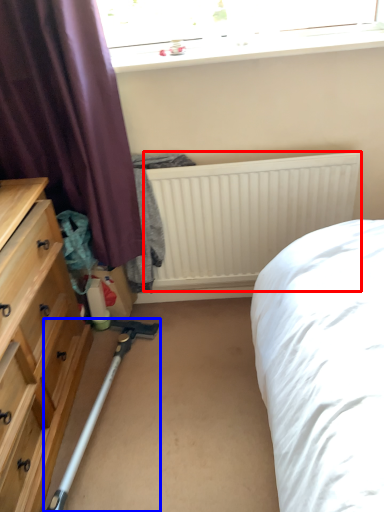
Question: Among these objects, which one is nearest to the camera, radiator (highlighted by a red box) or equipment (highlighted by a blue box)?

Choices:
 (A) radiator
 (B) equipment

Answer: (B)